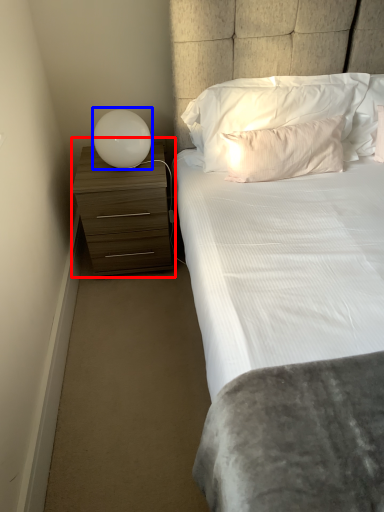
Question: Which of the following is the closest to the observer, chest of drawers (highlighted by a red box) or lamp (highlighted by a blue box)?

Choices:
 (A) chest of drawers
 (B) lamp

Answer: (B)